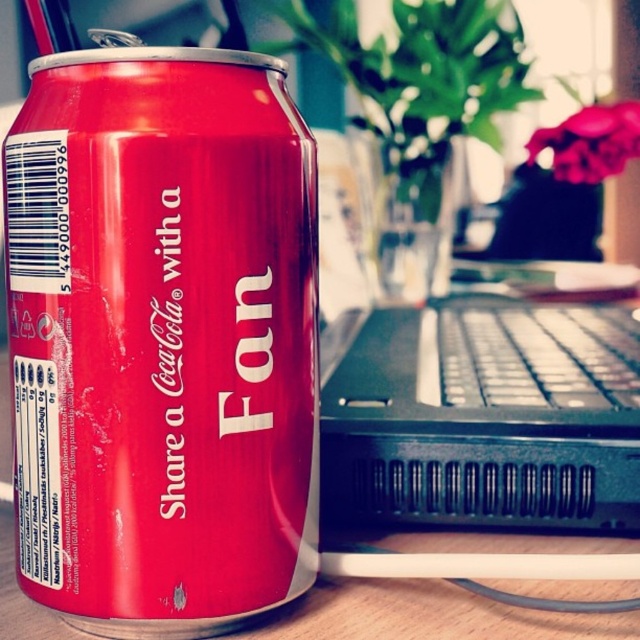
Where is the matte red can at center located in the image?

The matte red can at center is located at point coordinates of 0.528 on the x axis and 0.253 on the y axis.

You are looking at the image and want to locate the red Coca Cola can. Which object in the scene is at the point with coordinates (161, 337)?

The point at coordinates (161, 337) corresponds to the matte red can at center.

You have a small toy car that is 3 inches long. You want to move it from the matte red can at center to the black plastic keyboard at center. Can it travel the entire distance without any obstacles?

The matte red can at center and black plastic keyboard at center are 14.00 inches apart from each other. Since the toy car is only 3 inches long, it can easily travel the entire 14.00 inch distance between them without any issues.